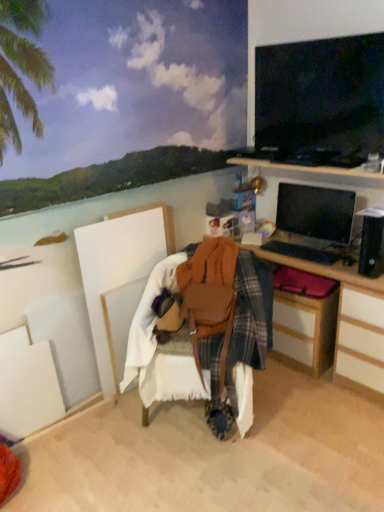
Identify the location of vacant point to the right of leather at center. (321, 424).